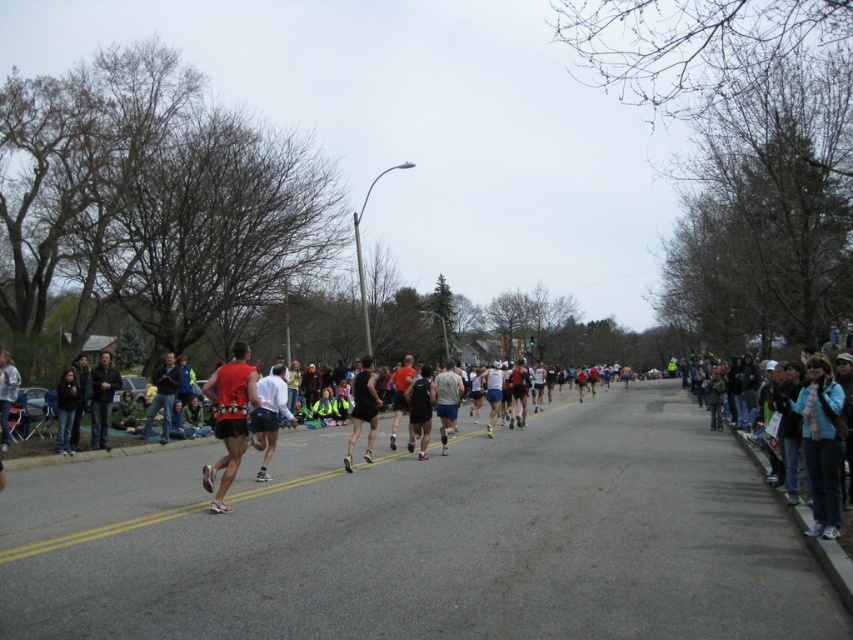
In the scene shown: You are a photographer positioned at the starting line of the marathon. You want to capture a photo of both the blue fleece jacket at right and the matte black shorts at center. Which object should you zoom in on to ensure both are clearly visible in your shot?

The blue fleece jacket at right is wider than the matte black shorts at center. To ensure both are clearly visible, you should zoom in on the blue fleece jacket at right since it is larger and will be easier to capture in the frame.

You are a photographer positioned at the starting line of the marathon. You want to take a photo that includes both the blue fleece jacket at right and the matte black shorts at center. Which object should you zoom in on to ensure both are clearly visible in the frame?

You should zoom in on the blue fleece jacket at right because it is larger than the matte black shorts at center, so it will be easier to capture both in the frame without losing detail on the smaller object.